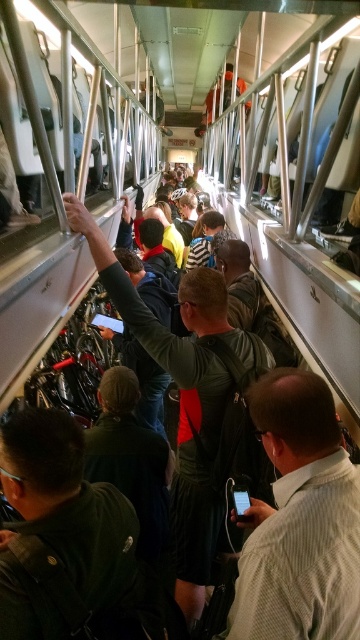
Who is lower down, dark green jacket at center or dark gray leather jacket at center?

dark green jacket at center

Based on the photo, is dark green jacket at center thinner than dark gray leather jacket at center?

Yes.

Who is more distant from viewer, (51, 540) or (201, 532)?

Point (201, 532)

Find the location of a particular element. The image size is (360, 640). dark green jacket at center is located at coordinates tap(69, 506).

Which is in front, point (258, 600) or point (181, 339)?

Positioned in front is point (258, 600).

Can you confirm if light brown shirt at center is bigger than dark gray leather jacket at center?

Incorrect, light brown shirt at center is not larger than dark gray leather jacket at center.

Is point (320, 516) closer to viewer compared to point (219, 388)?

Yes, point (320, 516) is closer to viewer.

This screenshot has height=640, width=360. In order to click on light brown shirt at center in this screenshot , I will do `click(299, 520)`.

Is light brown shirt at center further to camera compared to dark green jacket at center?

Yes, it is behind dark green jacket at center.

Is light brown shirt at center thinner than dark green jacket at center?

No, light brown shirt at center is not thinner than dark green jacket at center.

Image resolution: width=360 pixels, height=640 pixels. Describe the element at coordinates (299, 520) in the screenshot. I see `light brown shirt at center` at that location.

The image size is (360, 640). In order to click on light brown shirt at center in this screenshot , I will do `click(299, 520)`.